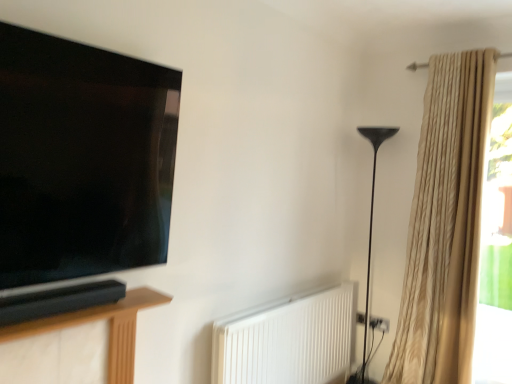
Question: Does brown wood soundbar at lower left have a greater height compared to black metal floor lamp at right?

Choices:
 (A) yes
 (B) no

Answer: (B)

Question: Are brown wood soundbar at lower left and black metal floor lamp at right far apart?

Choices:
 (A) yes
 (B) no

Answer: (A)

Question: Can you confirm if brown wood soundbar at lower left is wider than black metal floor lamp at right?

Choices:
 (A) yes
 (B) no

Answer: (B)

Question: Is brown wood soundbar at lower left shorter than black metal floor lamp at right?

Choices:
 (A) no
 (B) yes

Answer: (B)

Question: Is brown wood soundbar at lower left oriented away from black metal floor lamp at right?

Choices:
 (A) yes
 (B) no

Answer: (B)

Question: From the image's perspective, is brown wood soundbar at lower left on top of black metal floor lamp at right?

Choices:
 (A) no
 (B) yes

Answer: (B)

Question: Could you tell me if beige textured curtain at right is turned towards translucent glass window at right?

Choices:
 (A) yes
 (B) no

Answer: (B)

Question: Does beige textured curtain at right have a lesser width compared to translucent glass window at right?

Choices:
 (A) yes
 (B) no

Answer: (B)

Question: Is the position of beige textured curtain at right more distant than that of translucent glass window at right?

Choices:
 (A) no
 (B) yes

Answer: (A)

Question: Is beige textured curtain at right located outside translucent glass window at right?

Choices:
 (A) no
 (B) yes

Answer: (B)

Question: Can you confirm if beige textured curtain at right is taller than translucent glass window at right?

Choices:
 (A) yes
 (B) no

Answer: (A)

Question: Does beige textured curtain at right have a lesser height compared to translucent glass window at right?

Choices:
 (A) yes
 (B) no

Answer: (B)

Question: Does black metal floor lamp at right touch matte black tv at left?

Choices:
 (A) no
 (B) yes

Answer: (A)